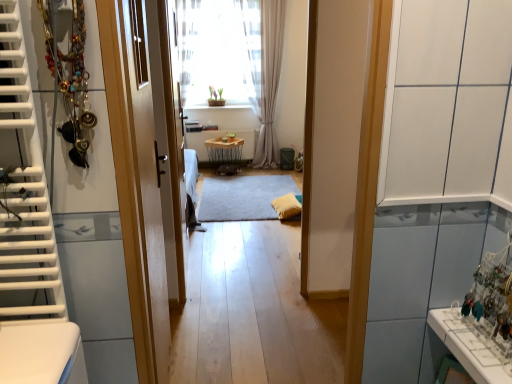
This screenshot has height=384, width=512. Find the location of `vacant area that lies between transparent plastic screen door at center and gray soft rug at center`. vacant area that lies between transparent plastic screen door at center and gray soft rug at center is located at coordinates (233, 240).